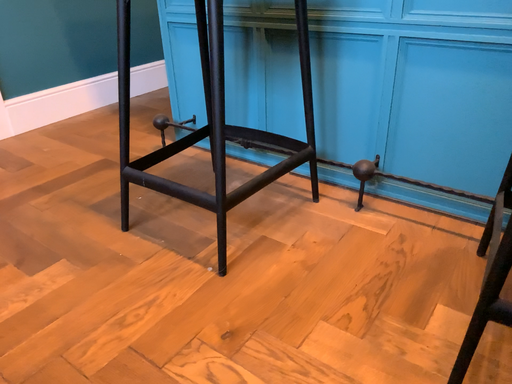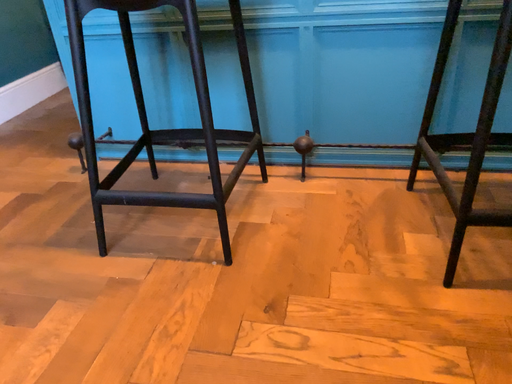
Question: Which way did the camera rotate in the video?

Choices:
 (A) rotated left
 (B) rotated right

Answer: (B)